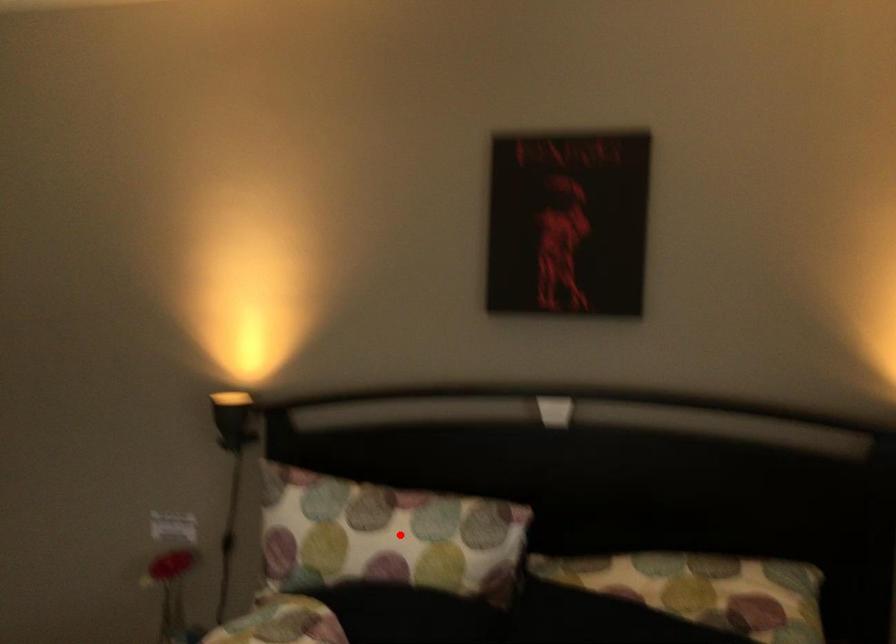
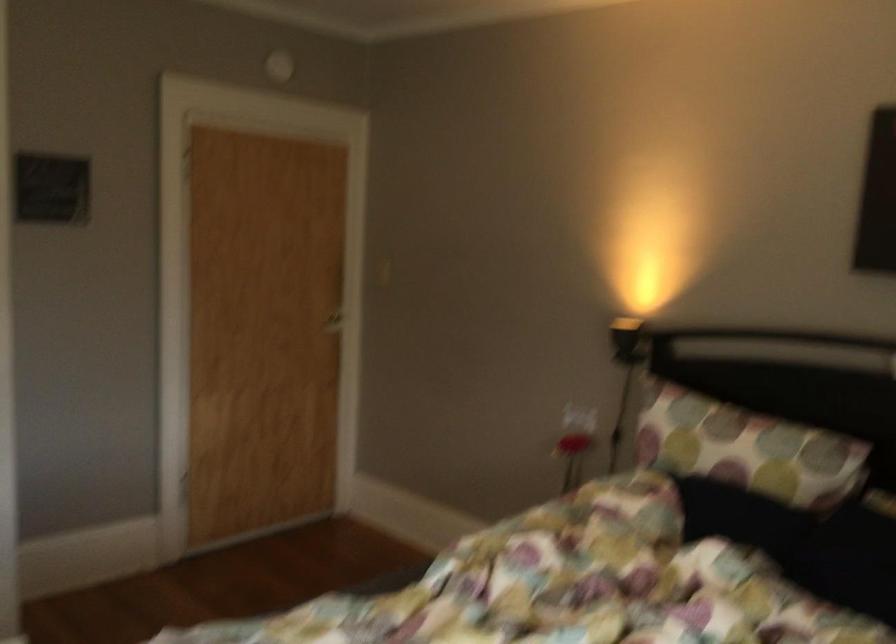
In the second image, find the point that corresponds to the highlighted location in the first image.

(746, 449)